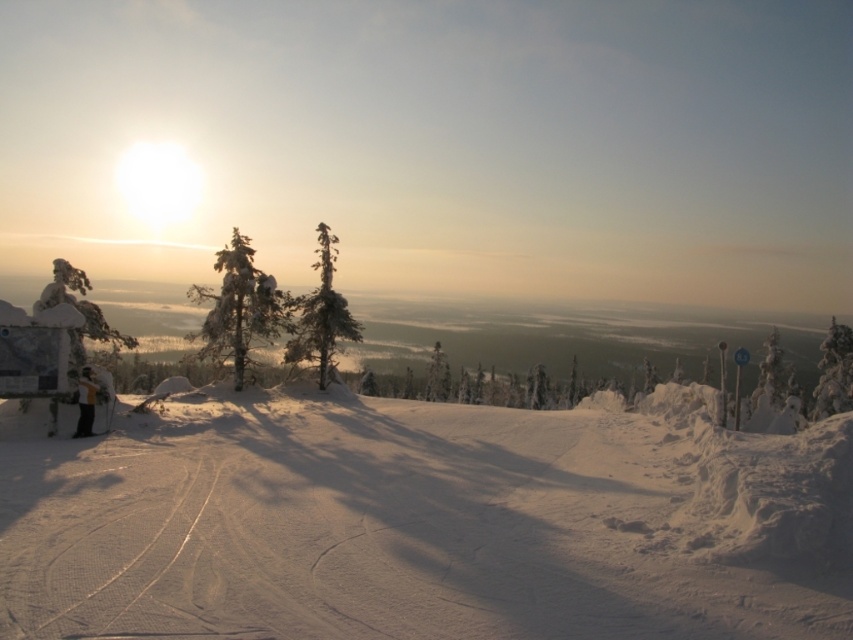
Measure the distance from white powdery snow at center to snow-covered evergreen tree at right.

A distance of 116.89 feet exists between white powdery snow at center and snow-covered evergreen tree at right.

Does white powdery snow at center come behind snow-covered evergreen tree at right?

That is False.

Describe the element at coordinates (427, 525) in the screenshot. I see `white powdery snow at center` at that location.

Identify the location of white powdery snow at center. The width and height of the screenshot is (853, 640). (427, 525).

Is white powdery snow at center wider than white frosty tree at right?

No, white powdery snow at center is not wider than white frosty tree at right.

Can you confirm if white powdery snow at center is positioned to the left of white frosty tree at right?

Indeed, white powdery snow at center is positioned on the left side of white frosty tree at right.

Who is more distant from viewer, [782,529] or [776,356]?

The point [776,356] is behind.

Find the location of a particular element. white powdery snow at center is located at coordinates (427, 525).

Is snow-covered evergreen tree at center shorter than snow-covered evergreen tree at right?

Yes.

Does point (323, 369) come closer to viewer compared to point (830, 403)?

Yes, it is.

Image resolution: width=853 pixels, height=640 pixels. I want to click on snow-covered evergreen tree at center, so click(321, 314).